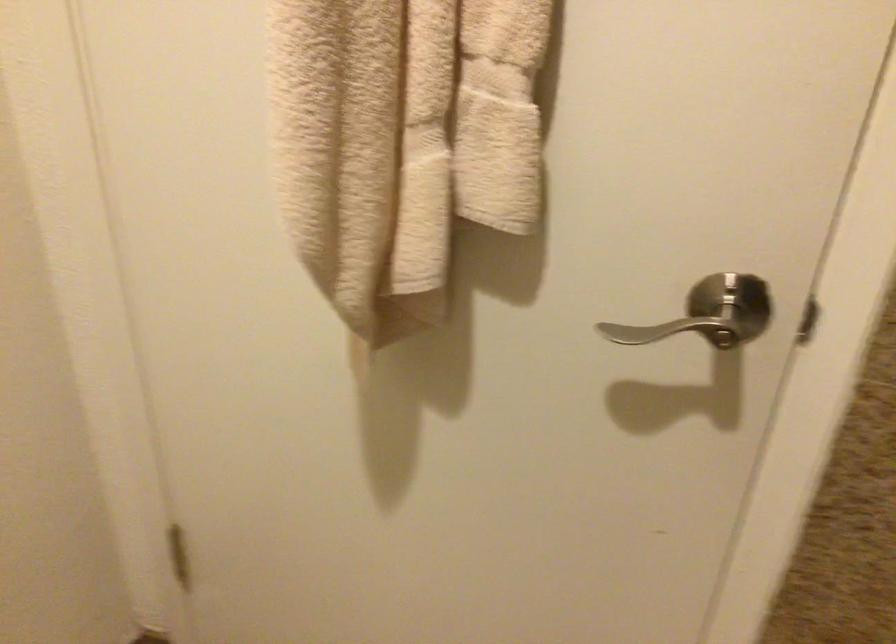
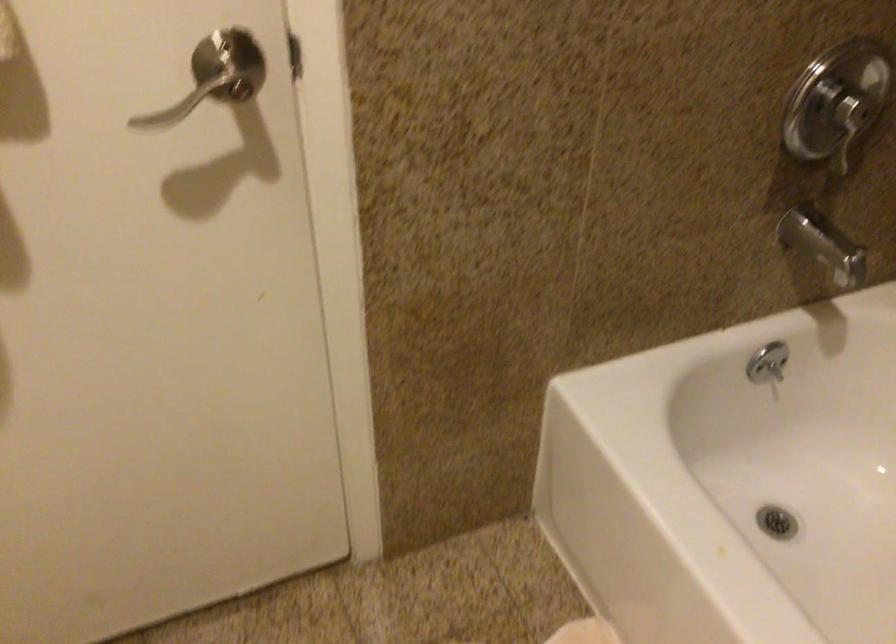
How did the camera likely rotate?

The camera's rotation is toward right-down.